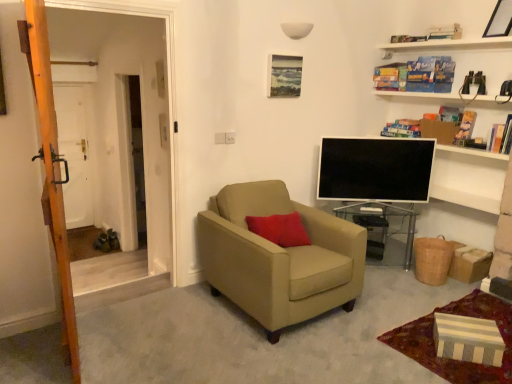
Where is `free space that is to the left of beige fabric armchair at center`? The height and width of the screenshot is (384, 512). free space that is to the left of beige fabric armchair at center is located at coordinates (169, 313).